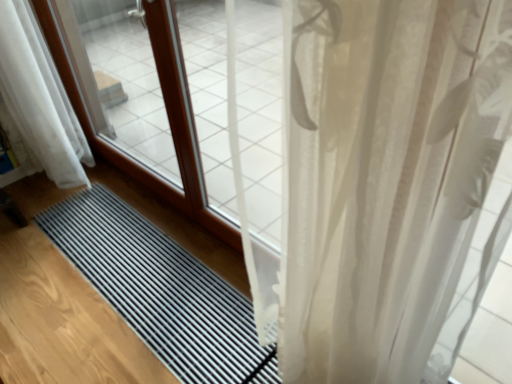
The width and height of the screenshot is (512, 384). What do you see at coordinates (40, 98) in the screenshot?
I see `white sheer curtain at lower left, the second curtain when ordered from right to left` at bounding box center [40, 98].

What do you see at coordinates (161, 290) in the screenshot? The image size is (512, 384). I see `black rubber mat at center` at bounding box center [161, 290].

Image resolution: width=512 pixels, height=384 pixels. What are the coordinates of `white sheer curtain at lower left, positioned as the second curtain in front-to-back order` in the screenshot? It's located at (40, 98).

Looking at the image, does translucent white curtain at right, arranged as the first curtain when viewed from the right, seem bigger or smaller compared to white sheer curtain at lower left, positioned as the second curtain in front-to-back order?

In the image, translucent white curtain at right, arranged as the first curtain when viewed from the right, appears to be smaller than white sheer curtain at lower left, positioned as the second curtain in front-to-back order.

From the image's perspective, between translucent white curtain at right, arranged as the first curtain when viewed from the right, and white sheer curtain at lower left, which appears as the first curtain when viewed from the back, which one is located above?

white sheer curtain at lower left, which appears as the first curtain when viewed from the back, appears higher in the image.

Could you measure the distance between translucent white curtain at right, which is the first curtain in front-to-back order, and white sheer curtain at lower left, positioned as the second curtain in front-to-back order?

A distance of 6.23 feet exists between translucent white curtain at right, which is the first curtain in front-to-back order, and white sheer curtain at lower left, positioned as the second curtain in front-to-back order.

Which point is more distant from viewer, (481,132) or (67,110)?

The point (67,110) is farther.

Could you measure the distance between white sheer curtain at lower left, which is counted as the 1th curtain, starting from the left, and black rubber mat at center?

A distance of 70.28 centimeters exists between white sheer curtain at lower left, which is counted as the 1th curtain, starting from the left, and black rubber mat at center.

Considering the relative positions of white sheer curtain at lower left, which is counted as the 1th curtain, starting from the left, and black rubber mat at center in the image provided, is white sheer curtain at lower left, which is counted as the 1th curtain, starting from the left, to the right of black rubber mat at center from the viewer's perspective?

Incorrect, white sheer curtain at lower left, which is counted as the 1th curtain, starting from the left, is not on the right side of black rubber mat at center.

From a real-world perspective, is white sheer curtain at lower left, positioned as the second curtain in front-to-back order, above or below black rubber mat at center?

In terms of real-world spatial position, white sheer curtain at lower left, positioned as the second curtain in front-to-back order, is above black rubber mat at center.

Which object is closer to the camera, white sheer curtain at lower left, positioned as the second curtain in front-to-back order, or black rubber mat at center?

black rubber mat at center is in front.

Is white sheer curtain at lower left, the second curtain when ordered from right to left, positioned beyond the bounds of translucent white curtain at right, which is the first curtain in front-to-back order?

white sheer curtain at lower left, the second curtain when ordered from right to left, is positioned outside translucent white curtain at right, which is the first curtain in front-to-back order.

Considering the relative positions of white sheer curtain at lower left, the second curtain when ordered from right to left, and translucent white curtain at right, which is the first curtain in front-to-back order, in the image provided, is white sheer curtain at lower left, the second curtain when ordered from right to left, to the left or to the right of translucent white curtain at right, which is the first curtain in front-to-back order,?

white sheer curtain at lower left, the second curtain when ordered from right to left, is positioned on translucent white curtain at right, which is the first curtain in front-to-back order,'s left side.

Is white sheer curtain at lower left, positioned as the second curtain in front-to-back order, smaller than translucent white curtain at right, acting as the second curtain starting from the left?

No, white sheer curtain at lower left, positioned as the second curtain in front-to-back order, is not smaller than translucent white curtain at right, acting as the second curtain starting from the left.

From the image's perspective, would you say white sheer curtain at lower left, positioned as the second curtain in front-to-back order, is positioned over translucent white curtain at right, arranged as the first curtain when viewed from the right?

Yes, from the image's perspective, white sheer curtain at lower left, positioned as the second curtain in front-to-back order, is over translucent white curtain at right, arranged as the first curtain when viewed from the right.

Considering the relative sizes of black rubber mat at center and translucent white curtain at right, which is the first curtain in front-to-back order, in the image provided, is black rubber mat at center shorter than translucent white curtain at right, which is the first curtain in front-to-back order,?

Correct, black rubber mat at center is not as tall as translucent white curtain at right, which is the first curtain in front-to-back order.

Does point (82, 206) come farther from viewer compared to point (423, 116)?

Yes.

Where is `mat below the translucent white curtain at right, which is the first curtain in front-to-back order (from the image's perspective)`? The image size is (512, 384). mat below the translucent white curtain at right, which is the first curtain in front-to-back order (from the image's perspective) is located at coordinates (161, 290).

Is black rubber mat at center beside translucent white curtain at right, marked as the second curtain in a back-to-front arrangement?

No, black rubber mat at center is not with translucent white curtain at right, marked as the second curtain in a back-to-front arrangement.

Does black rubber mat at center appear on the right side of white sheer curtain at lower left, positioned as the second curtain in front-to-back order?

Yes, black rubber mat at center is to the right of white sheer curtain at lower left, positioned as the second curtain in front-to-back order.

From the image's perspective, which object appears higher, black rubber mat at center or white sheer curtain at lower left, which appears as the first curtain when viewed from the back?

white sheer curtain at lower left, which appears as the first curtain when viewed from the back, from the image's perspective.

Considering the relative sizes of black rubber mat at center and white sheer curtain at lower left, the second curtain when ordered from right to left, in the image provided, is black rubber mat at center thinner than white sheer curtain at lower left, the second curtain when ordered from right to left,?

No, black rubber mat at center is not thinner than white sheer curtain at lower left, the second curtain when ordered from right to left.

Is black rubber mat at center beside white sheer curtain at lower left, the second curtain when ordered from right to left?

No, black rubber mat at center is not touching white sheer curtain at lower left, the second curtain when ordered from right to left.

Does translucent white curtain at right, acting as the second curtain starting from the left, appear on the right side of black rubber mat at center?

Indeed, translucent white curtain at right, acting as the second curtain starting from the left, is positioned on the right side of black rubber mat at center.

In order to click on mat below the translucent white curtain at right, which is the first curtain in front-to-back order (from the image's perspective) in this screenshot , I will do `click(161, 290)`.

Does translucent white curtain at right, acting as the second curtain starting from the left, have a smaller size compared to black rubber mat at center?

No.

From a real-world perspective, is translucent white curtain at right, which is the first curtain in front-to-back order, physically located above or below black rubber mat at center?

From a real-world perspective, translucent white curtain at right, which is the first curtain in front-to-back order, is physically above black rubber mat at center.

At what (x,y) coordinates should I click in order to perform the action: click on curtain below the white sheer curtain at lower left, the second curtain when ordered from right to left (from the image's perspective). Please return your answer as a coordinate pair (x, y). Looking at the image, I should click on (391, 183).

This screenshot has height=384, width=512. Find the location of `mat that is in front of the white sheer curtain at lower left, positioned as the second curtain in front-to-back order`. mat that is in front of the white sheer curtain at lower left, positioned as the second curtain in front-to-back order is located at coordinates (161, 290).

Looking at the image, which one is located further to white sheer curtain at lower left, the second curtain when ordered from right to left, black rubber mat at center or translucent white curtain at right, arranged as the first curtain when viewed from the right?

The object further to white sheer curtain at lower left, the second curtain when ordered from right to left, is translucent white curtain at right, arranged as the first curtain when viewed from the right.

Based on their spatial positions, is white sheer curtain at lower left, which appears as the first curtain when viewed from the back, or translucent white curtain at right, acting as the second curtain starting from the left, further from black rubber mat at center?

The object further to black rubber mat at center is translucent white curtain at right, acting as the second curtain starting from the left.

Based on their spatial positions, is white sheer curtain at lower left, the second curtain when ordered from right to left, or black rubber mat at center closer to translucent white curtain at right, which is the first curtain in front-to-back order?

Among the two, black rubber mat at center is located nearer to translucent white curtain at right, which is the first curtain in front-to-back order.

From the image, which object appears to be nearer to translucent white curtain at right, marked as the second curtain in a back-to-front arrangement, black rubber mat at center or white sheer curtain at lower left, which is counted as the 1th curtain, starting from the left?

black rubber mat at center is positioned closer to the anchor translucent white curtain at right, marked as the second curtain in a back-to-front arrangement.

From the image, which object appears to be farther from black rubber mat at center, translucent white curtain at right, marked as the second curtain in a back-to-front arrangement, or white sheer curtain at lower left, the second curtain when ordered from right to left?

translucent white curtain at right, marked as the second curtain in a back-to-front arrangement, is further to black rubber mat at center.

Which object lies nearer to the anchor point white sheer curtain at lower left, which is counted as the 1th curtain, starting from the left, translucent white curtain at right, which is the first curtain in front-to-back order, or black rubber mat at center?

black rubber mat at center.

Locate an element on the screen. mat between white sheer curtain at lower left, the second curtain when ordered from right to left, and translucent white curtain at right, marked as the second curtain in a back-to-front arrangement, in the horizontal direction is located at coordinates (161, 290).